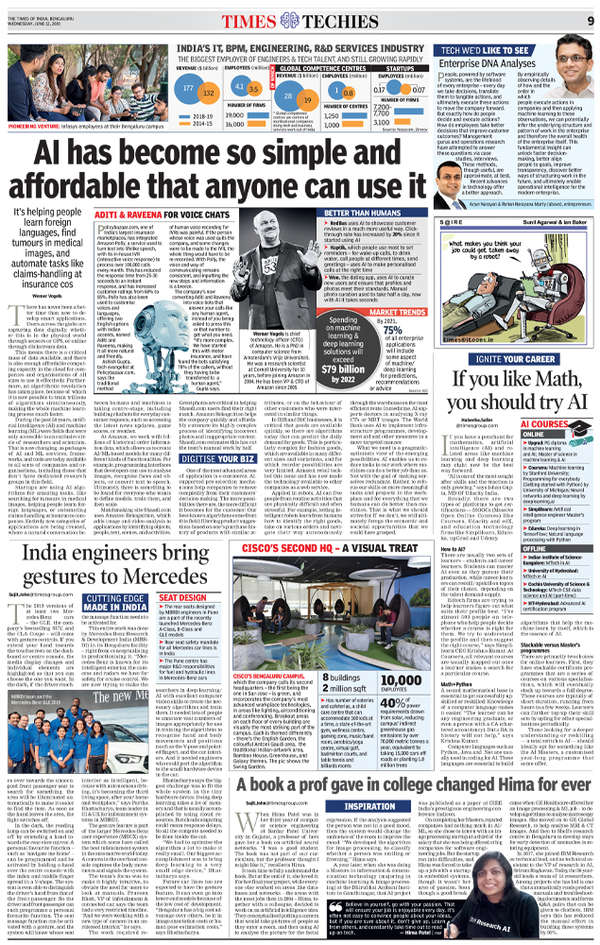
The height and width of the screenshot is (945, 600). I want to click on green curtain, so click(557, 243).